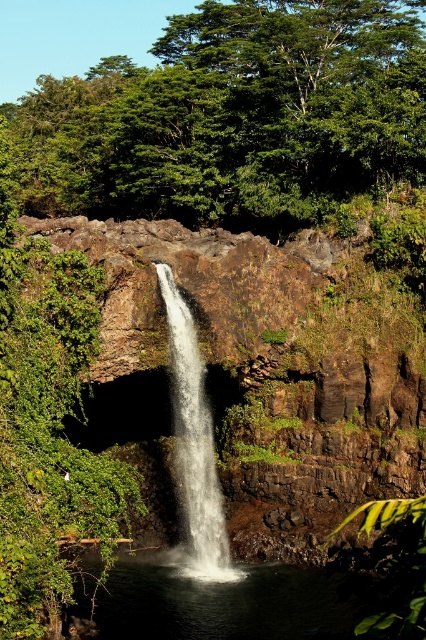
You are a hiker standing at the base of the cliff. You notice a green leafy tree at upper center and translucent white water at center. Which object is bigger in size?

The green leafy tree at upper center has a larger size compared to the translucent white water at center.

You are a hiker who wants to cross the waterfall area. You notice two types of water in the center area. The clear water at center and the translucent white water at center. Which one is farther from you?

The clear water at center and translucent white water at center are 20.92 feet apart. The translucent white water at center is farther away from you since it is the one cascading down the cliff, while the clear water at center is closer, forming the pool at the bottom.

You are standing at the base of the cliff and want to reach the green leafy tree at upper center. Which direction should you move relative to the translucent white water at center?

The green leafy tree at upper center is further to the viewer than the translucent white water at center, so you should move towards the translucent white water at center to reach the tree.